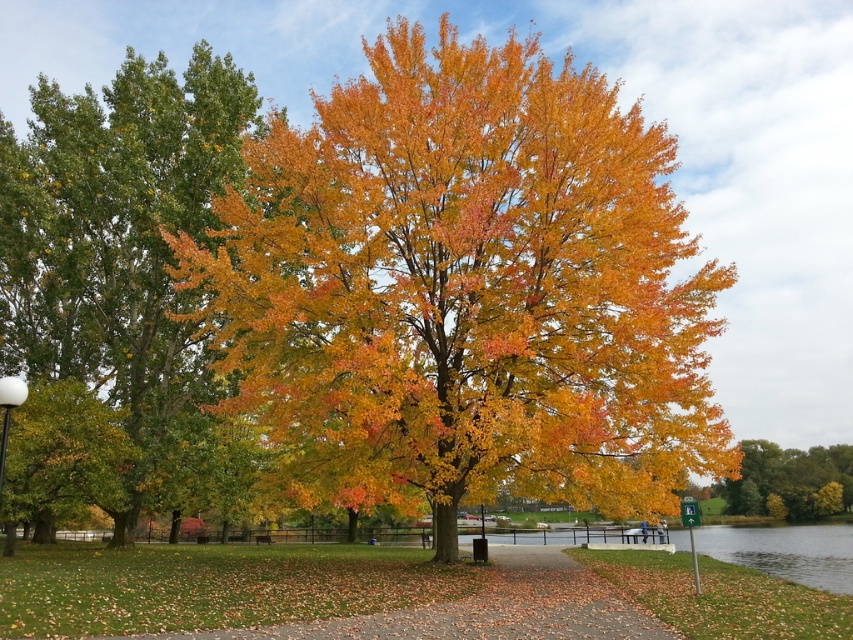
Can you confirm if golden yellow leaves at center is shorter than golden yellow leaves at right?

In fact, golden yellow leaves at center may be taller than golden yellow leaves at right.

Consider the image. Is golden yellow leaves at center below golden yellow leaves at right?

No, golden yellow leaves at center is not below golden yellow leaves at right.

Measure the distance between point (641,291) and camera.

They are 45.09 feet apart.

The width and height of the screenshot is (853, 640). I want to click on golden yellow leaves at center, so coord(467,289).

Between point (44, 394) and point (796, 467), which one is positioned in front?

Point (44, 394) is more forward.

Does shiny green leaf at left have a lesser width compared to golden yellow leaves at right?

Yes.

Does point (22, 440) lie behind point (834, 456)?

That is False.

Identify the location of shiny green leaf at left. The image size is (853, 640). (62, 452).

Can you confirm if green leafy tree at left is wider than shiny green leaf at left?

Yes, green leafy tree at left is wider than shiny green leaf at left.

Is green leafy tree at left to the left of shiny green leaf at left from the viewer's perspective?

Yes, green leafy tree at left is to the left of shiny green leaf at left.

Is point (143, 428) closer to viewer compared to point (73, 490)?

That is False.

Identify the location of green leafy tree at left. Image resolution: width=853 pixels, height=640 pixels. pyautogui.click(x=114, y=225).